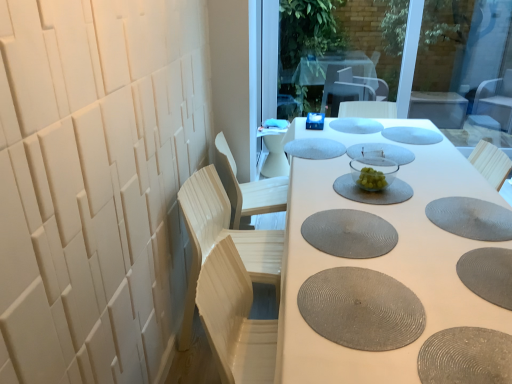
Identify the location of free point behind gray textured placemat at lower right, the 6th manhole cover in the back-to-front sequence. (439, 183).